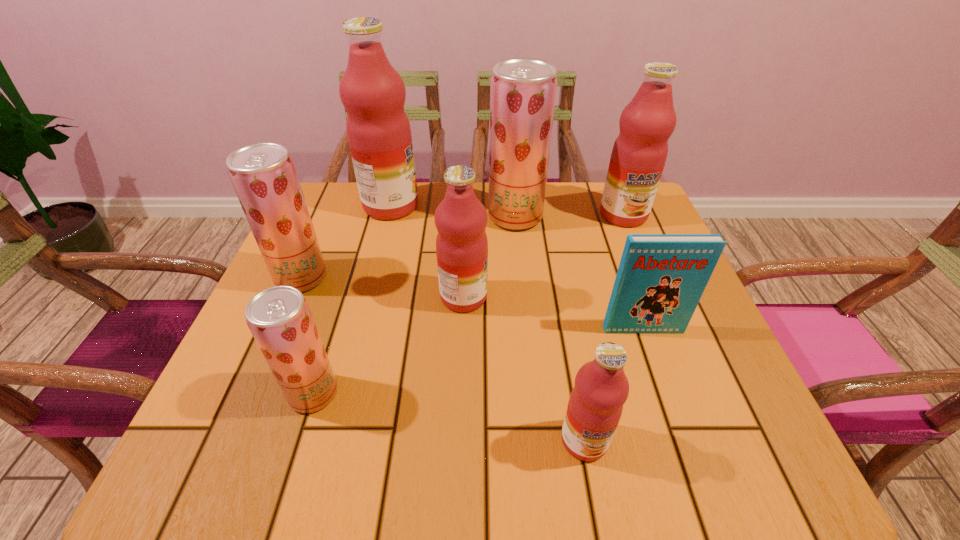
This screenshot has width=960, height=540. Find the location of `object that is the second closest to the book`. object that is the second closest to the book is located at coordinates (461, 244).

Locate an element on the screen. The image size is (960, 540). fruit juice that stands as the closest to the nearest strawberry fruit juice is located at coordinates (263, 175).

Identify which fruit juice is located as the fourth nearest to the rightmost pink fruit juice. Please provide its 2D coordinates. Your answer should be formatted as a tuple, i.e. [(x, y)], where the tuple contains the x and y coordinates of a point satisfying the conditions above.

[(601, 388)]

Identify which pink fruit juice is the third nearest to the fourth object from left to right. Please provide its 2D coordinates. Your answer should be formatted as a tuple, i.e. [(x, y)], where the tuple contains the x and y coordinates of a point satisfying the conditions above.

[(639, 153)]

Where is `pink fruit juice identified as the closest to the third nearest object`? The height and width of the screenshot is (540, 960). pink fruit juice identified as the closest to the third nearest object is located at coordinates tap(601, 388).

The height and width of the screenshot is (540, 960). Find the location of `the second closest strawberry fruit juice to the nearest object`. the second closest strawberry fruit juice to the nearest object is located at coordinates (522, 98).

I want to click on strawberry fruit juice identified as the closest to the leftmost strawberry fruit juice, so click(x=279, y=318).

You are a GUI agent. You are given a task and a screenshot of the screen. Output one action in this format:
    pyautogui.click(x=<x>, y=<y>)
    Task: Click on the vacant area in the image that satisfies the following two spatial constraints: 1. on the front side of the biggest strawberry fruit juice; 2. on the label of the third farthest pink fruit juice
    The height and width of the screenshot is (540, 960).
    Given the screenshot: What is the action you would take?
    pyautogui.click(x=523, y=297)

You are a GUI agent. You are given a task and a screenshot of the screen. Output one action in this format:
    pyautogui.click(x=<x>, y=<y>)
    Task: Click on the free point that satisfies the following two spatial constraints: 1. on the back side of the sixth farthest fruit juice; 2. on the left side of the rightmost strawberry fruit juice
    This screenshot has width=960, height=540.
    Given the screenshot: What is the action you would take?
    pyautogui.click(x=370, y=217)

Where is `free space that satisfies the following two spatial constraints: 1. on the back side of the farthest strawberry fruit juice; 2. on the left side of the smallest strawberry fruit juice`? The height and width of the screenshot is (540, 960). free space that satisfies the following two spatial constraints: 1. on the back side of the farthest strawberry fruit juice; 2. on the left side of the smallest strawberry fruit juice is located at coordinates (370, 217).